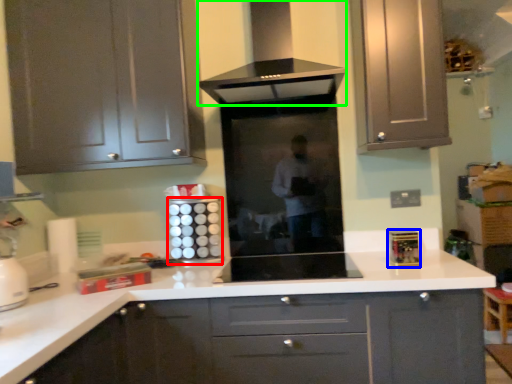
Question: Based on their relative distances, which object is nearer to appliance (highlighted by a red box)? Choose from appliance (highlighted by a blue box) and home appliance (highlighted by a green box).

Choices:
 (A) appliance
 (B) home appliance

Answer: (B)